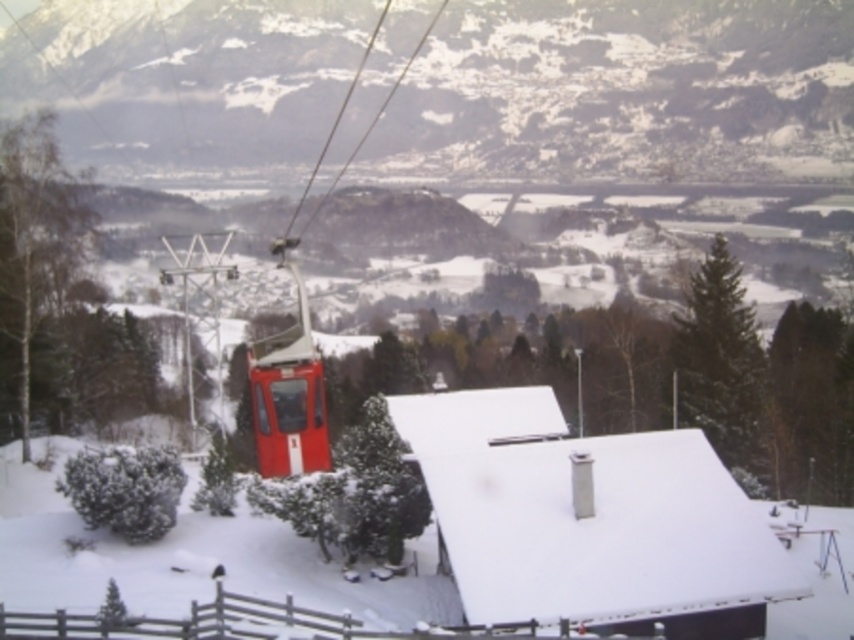
Question: From the image, what is the correct spatial relationship of white matte roof at center in relation to brown wooden fence at lower center?

Choices:
 (A) above
 (B) below

Answer: (A)

Question: Is white matte roof at center closer to camera compared to brown wooden fence at lower center?

Choices:
 (A) no
 (B) yes

Answer: (A)

Question: Is white matte roof at center to the left of brown wooden fence at lower center from the viewer's perspective?

Choices:
 (A) yes
 (B) no

Answer: (B)

Question: Among these points, which one is nearest to the camera?

Choices:
 (A) (619, 524)
 (B) (390, 632)

Answer: (B)